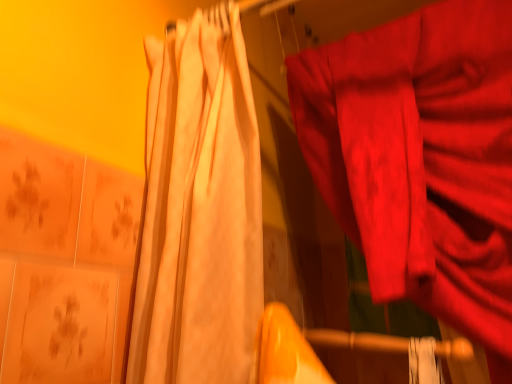
Question: Is matte red fabric at right, arranged as the second curtain when viewed from the left, wider than matte white curtain at left, the 2th curtain when ordered from right to left?

Choices:
 (A) no
 (B) yes

Answer: (A)

Question: Is matte red fabric at right, positioned as the 1th curtain in right-to-left order, further to the viewer compared to matte white curtain at left, the 2th curtain when ordered from right to left?

Choices:
 (A) no
 (B) yes

Answer: (B)

Question: Could you tell me if matte red fabric at right, arranged as the second curtain when viewed from the left, is facing matte white curtain at left, which is the 1th curtain from left to right?

Choices:
 (A) yes
 (B) no

Answer: (A)

Question: Is matte red fabric at right, arranged as the second curtain when viewed from the left, at the right side of matte white curtain at left, which is the 1th curtain from left to right?

Choices:
 (A) yes
 (B) no

Answer: (A)

Question: From the image's perspective, does matte red fabric at right, positioned as the 1th curtain in right-to-left order, appear lower than matte white curtain at left, which is the 1th curtain from left to right?

Choices:
 (A) no
 (B) yes

Answer: (B)

Question: Does matte red fabric at right, positioned as the 1th curtain in right-to-left order, have a smaller size compared to matte white curtain at left, the 2th curtain when ordered from right to left?

Choices:
 (A) yes
 (B) no

Answer: (B)

Question: From a real-world perspective, is matte white curtain at left, which is the 1th curtain from left to right, positioned under matte red fabric at right, positioned as the 1th curtain in right-to-left order, based on gravity?

Choices:
 (A) no
 (B) yes

Answer: (B)

Question: Is matte white curtain at left, which is the 1th curtain from left to right, oriented away from matte red fabric at right, arranged as the second curtain when viewed from the left?

Choices:
 (A) yes
 (B) no

Answer: (A)

Question: Is matte white curtain at left, which is the 1th curtain from left to right, taller than matte red fabric at right, positioned as the 1th curtain in right-to-left order?

Choices:
 (A) yes
 (B) no

Answer: (B)

Question: From a real-world perspective, is matte white curtain at left, which is the 1th curtain from left to right, on top of matte red fabric at right, positioned as the 1th curtain in right-to-left order?

Choices:
 (A) yes
 (B) no

Answer: (B)

Question: Considering the relative positions of matte white curtain at left, which is the 1th curtain from left to right, and matte red fabric at right, positioned as the 1th curtain in right-to-left order, in the image provided, is matte white curtain at left, which is the 1th curtain from left to right, to the right of matte red fabric at right, positioned as the 1th curtain in right-to-left order, from the viewer's perspective?

Choices:
 (A) yes
 (B) no

Answer: (B)

Question: Is matte white curtain at left, which is the 1th curtain from left to right, not inside matte red fabric at right, positioned as the 1th curtain in right-to-left order?

Choices:
 (A) no
 (B) yes

Answer: (B)

Question: From the image's perspective, is matte white curtain at left, the 2th curtain when ordered from right to left, above or below matte red fabric at right, positioned as the 1th curtain in right-to-left order?

Choices:
 (A) below
 (B) above

Answer: (B)